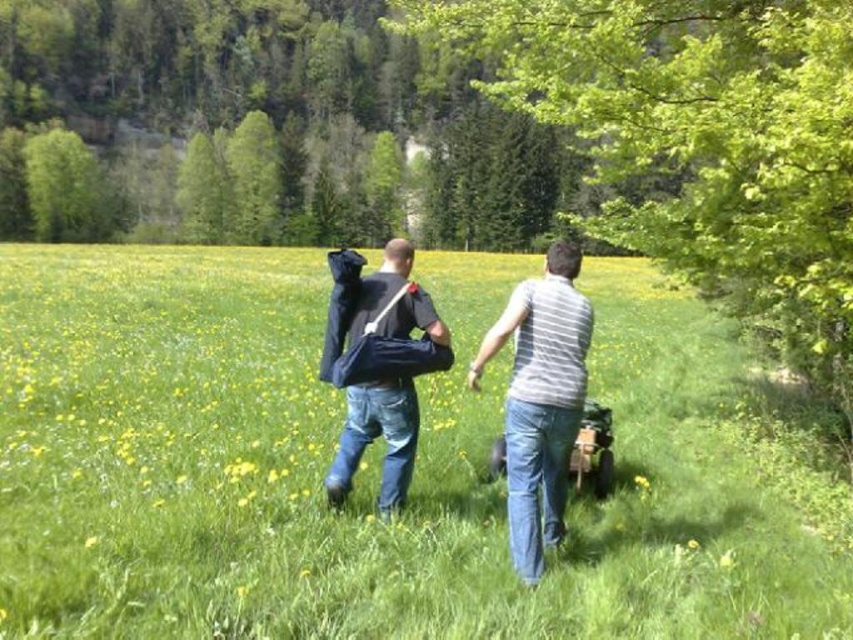
Between green leafy tree at upper right and denim jeans at center, which one appears on the right side from the viewer's perspective?

green leafy tree at upper right

Which is behind, point (598, 161) or point (386, 420)?

Point (598, 161)

Is point (782, 307) positioned before point (564, 310)?

No, it is not.

The image size is (853, 640). What are the coordinates of `green leafy tree at upper right` in the screenshot? It's located at (700, 141).

Does striped cotton shirt at center appear on the left side of yellow soft grass at center?

Correct, you'll find striped cotton shirt at center to the left of yellow soft grass at center.

Does striped cotton shirt at center have a lesser height compared to yellow soft grass at center?

No, striped cotton shirt at center is not shorter than yellow soft grass at center.

Is point (537, 532) more distant than point (639, 476)?

No, (537, 532) is in front of (639, 476).

Where is `striped cotton shirt at center`? The width and height of the screenshot is (853, 640). striped cotton shirt at center is located at coordinates (540, 400).

Can you confirm if denim jeans at center is smaller than yellow soft grass at center?

Incorrect, denim jeans at center is not smaller in size than yellow soft grass at center.

Locate an element on the screen. This screenshot has width=853, height=640. denim jeans at center is located at coordinates (540, 400).

Locate an element on the screen. This screenshot has height=640, width=853. denim jeans at center is located at coordinates (540, 400).